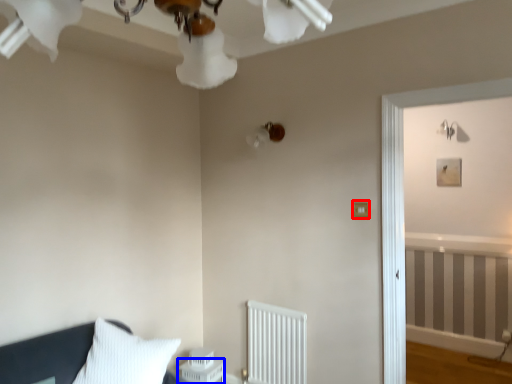
Question: Which object appears farthest to the camera in this image, light switch (highlighted by a red box) or table (highlighted by a blue box)?

Choices:
 (A) light switch
 (B) table

Answer: (B)